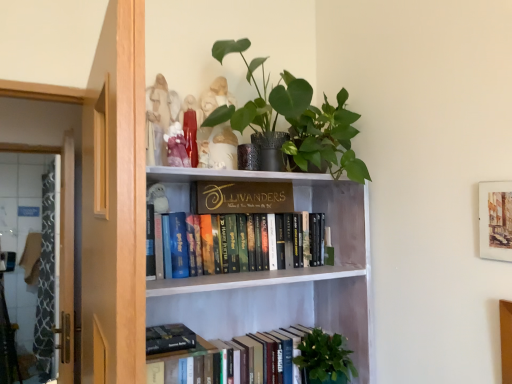
Question: Is there a large distance between gold metallic sign at upper center and wooden screen door at left?

Choices:
 (A) yes
 (B) no

Answer: (A)

Question: Considering the relative sizes of gold metallic sign at upper center and wooden screen door at left in the image provided, is gold metallic sign at upper center thinner than wooden screen door at left?

Choices:
 (A) no
 (B) yes

Answer: (B)

Question: Is gold metallic sign at upper center wider than wooden screen door at left?

Choices:
 (A) no
 (B) yes

Answer: (A)

Question: Does gold metallic sign at upper center appear on the left side of wooden screen door at left?

Choices:
 (A) no
 (B) yes

Answer: (A)

Question: From the image's perspective, is gold metallic sign at upper center over wooden screen door at left?

Choices:
 (A) no
 (B) yes

Answer: (B)

Question: Does gold metallic sign at upper center contain wooden screen door at left?

Choices:
 (A) no
 (B) yes

Answer: (A)

Question: Considering the relative sizes of green matte plant at upper center and watercolor paper picture frame at upper right in the image provided, is green matte plant at upper center wider than watercolor paper picture frame at upper right?

Choices:
 (A) yes
 (B) no

Answer: (A)

Question: Is watercolor paper picture frame at upper right completely or partially inside green matte plant at upper center?

Choices:
 (A) no
 (B) yes

Answer: (A)

Question: Is green matte plant at upper center positioned in front of watercolor paper picture frame at upper right?

Choices:
 (A) no
 (B) yes

Answer: (A)

Question: Does green matte plant at upper center have a smaller size compared to watercolor paper picture frame at upper right?

Choices:
 (A) no
 (B) yes

Answer: (A)

Question: Does green matte plant at upper center appear on the left side of watercolor paper picture frame at upper right?

Choices:
 (A) no
 (B) yes

Answer: (B)

Question: Is green matte plant at upper center outside of watercolor paper picture frame at upper right?

Choices:
 (A) yes
 (B) no

Answer: (A)

Question: Is white wood bookshelf at upper center positioned before green matte plant at lower center?

Choices:
 (A) no
 (B) yes

Answer: (B)